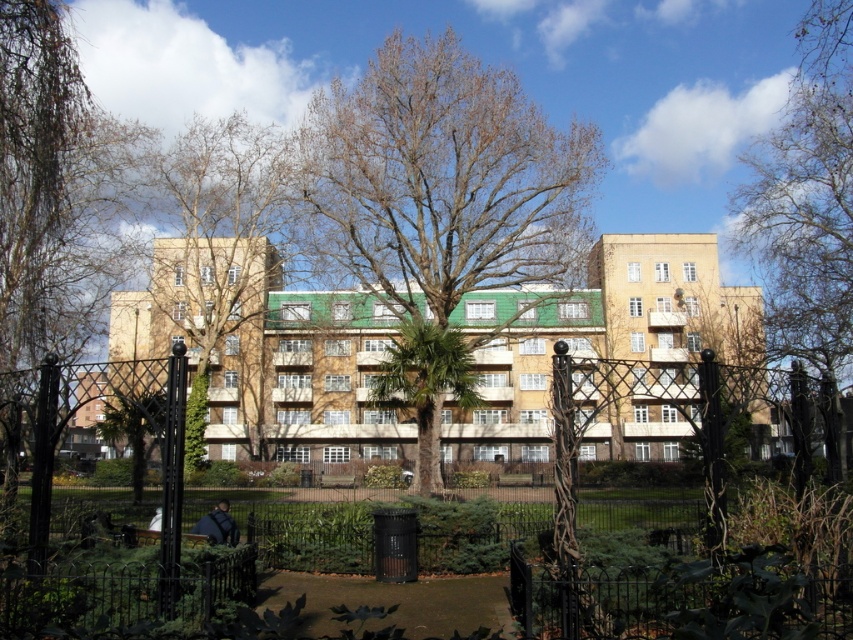
Is bare branches at center to the right of wooden park bench at center from the viewer's perspective?

No, bare branches at center is not to the right of wooden park bench at center.

Between bare branches at center and wooden park bench at center, which one is positioned lower?

wooden park bench at center is lower down.

Describe the element at coordinates (218, 252) in the screenshot. I see `bare branches at center` at that location.

Find the location of `bare branches at center`. bare branches at center is located at coordinates (218, 252).

Is bare wood tree at center below green textured lawn at center?

No.

Is point (320, 188) closer to camera compared to point (155, 358)?

No, it is not.

I want to click on bare wood tree at center, so click(440, 204).

Does point (36, 580) lie behind point (277, 168)?

No.

Between green textured lawn at center and bare branches at center, which one appears on the right side from the viewer's perspective?

green textured lawn at center

This screenshot has height=640, width=853. Identify the location of green textured lawn at center. (117, 582).